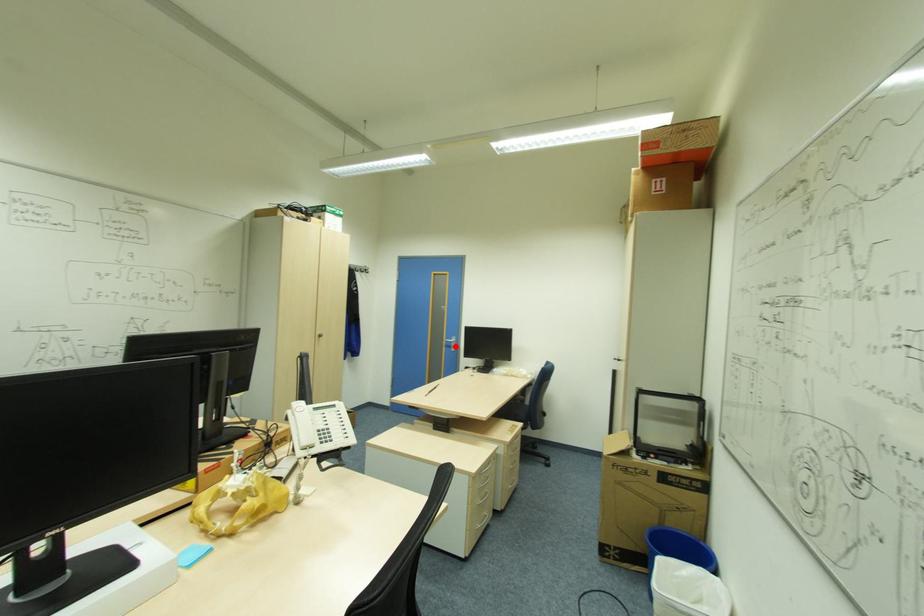
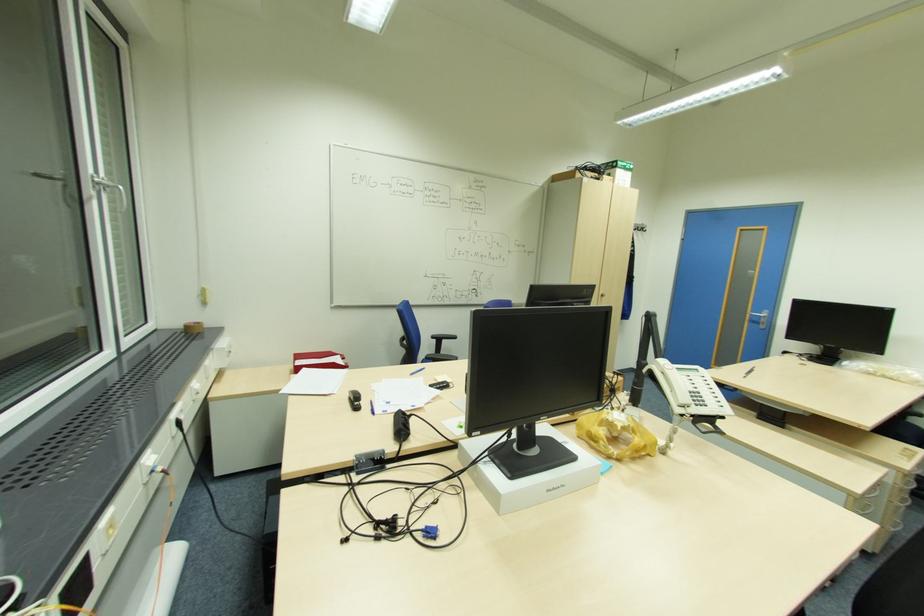
Question: I am providing you with two images of the same scene from different viewpoints. A red point is marked on the first image. At the location where the point appears in image 1, is it still visible in image 2?

Choices:
 (A) Yes
 (B) No

Answer: (A)